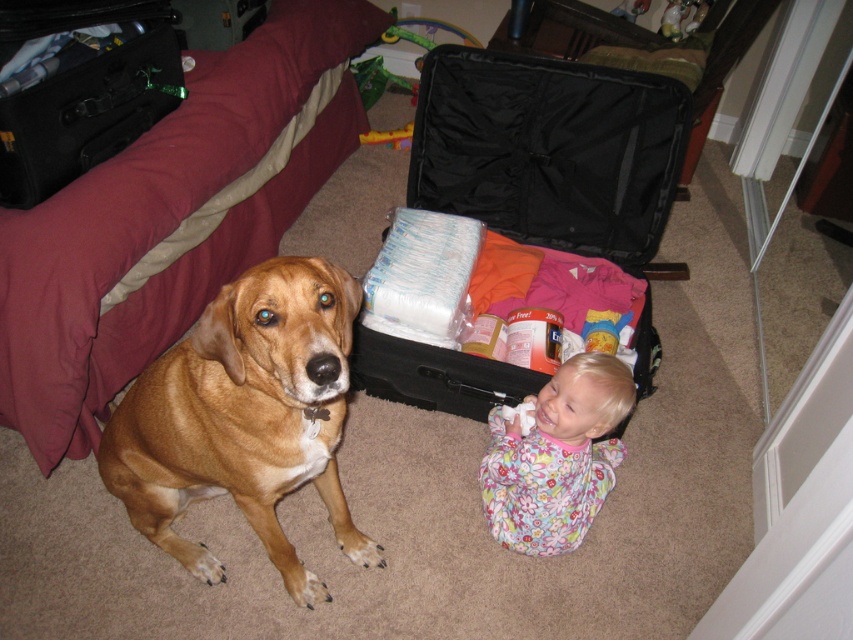
Does point (132, 442) lie behind point (566, 413)?

No, (132, 442) is in front of (566, 413).

Which is more to the left, brown furry dog at left or floral fabric baby at center?

From the viewer's perspective, brown furry dog at left appears more on the left side.

Who is more distant from viewer, (306,308) or (543,413)?

Positioned behind is point (543,413).

Locate an element on the screen. This screenshot has height=640, width=853. brown furry dog at left is located at coordinates (244, 417).

Is black fabric suitcase at center positioned at the back of floral fabric baby at center?

That is True.

Does point (473, 128) come farther from viewer compared to point (593, 380)?

Yes.

Who is more distant from viewer, (624, 202) or (572, 481)?

Point (624, 202)

Image resolution: width=853 pixels, height=640 pixels. What are the coordinates of `black fabric suitcase at center` in the screenshot? It's located at (549, 150).

Does black fabric suitcase at center have a greater width compared to brown furry dog at left?

Correct, the width of black fabric suitcase at center exceeds that of brown furry dog at left.

Is point (395, 365) closer to camera compared to point (285, 452)?

No, it is not.

Who is more distant from viewer, [646,147] or [312,273]?

Positioned behind is point [646,147].

I want to click on black fabric suitcase at center, so click(549, 150).